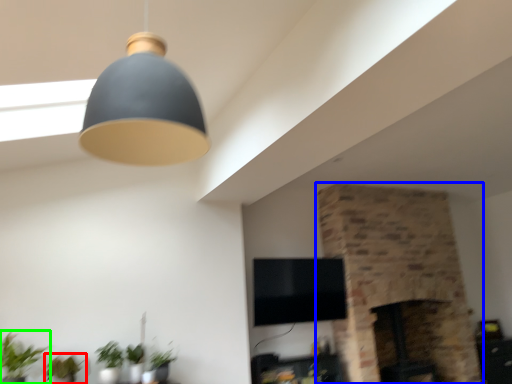
Question: Which object is the farthest from plant (highlighted by a red box)? Choose among these: fireplace (highlighted by a blue box) or houseplant (highlighted by a green box).

Choices:
 (A) fireplace
 (B) houseplant

Answer: (A)